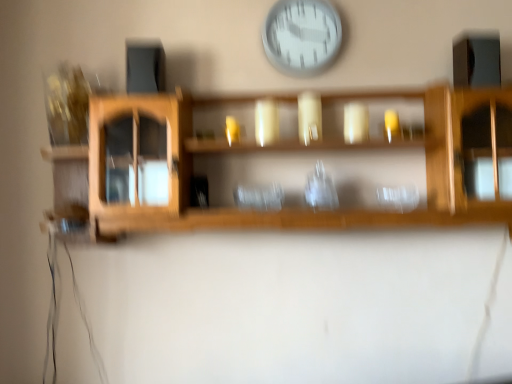
Question: Is wooden shelf at center facing towards transparent glass vase at center?

Choices:
 (A) yes
 (B) no

Answer: (A)

Question: Does wooden shelf at center have a greater height compared to transparent glass vase at center?

Choices:
 (A) yes
 (B) no

Answer: (A)

Question: Is wooden shelf at center at the right side of transparent glass vase at center?

Choices:
 (A) no
 (B) yes

Answer: (A)

Question: Considering the relative sizes of wooden shelf at center and transparent glass vase at center in the image provided, is wooden shelf at center wider than transparent glass vase at center?

Choices:
 (A) yes
 (B) no

Answer: (A)

Question: Is wooden shelf at center oriented away from transparent glass vase at center?

Choices:
 (A) yes
 (B) no

Answer: (A)

Question: Can we say wooden shelf at center lies outside transparent glass vase at center?

Choices:
 (A) yes
 (B) no

Answer: (A)

Question: Is transparent glass vase at center directly adjacent to wooden shelf at center?

Choices:
 (A) yes
 (B) no

Answer: (B)

Question: Is transparent glass vase at center to the left of wooden shelf at center from the viewer's perspective?

Choices:
 (A) no
 (B) yes

Answer: (A)

Question: Does transparent glass vase at center have a smaller size compared to wooden shelf at center?

Choices:
 (A) yes
 (B) no

Answer: (A)

Question: Is the depth of transparent glass vase at center greater than that of wooden shelf at center?

Choices:
 (A) yes
 (B) no

Answer: (A)

Question: Can you confirm if transparent glass vase at center is bigger than wooden shelf at center?

Choices:
 (A) no
 (B) yes

Answer: (A)

Question: Is transparent glass vase at center aimed at wooden shelf at center?

Choices:
 (A) no
 (B) yes

Answer: (B)

Question: Can we say transparent glass vase at center lies outside white plastic wall clock at upper center?

Choices:
 (A) no
 (B) yes

Answer: (B)